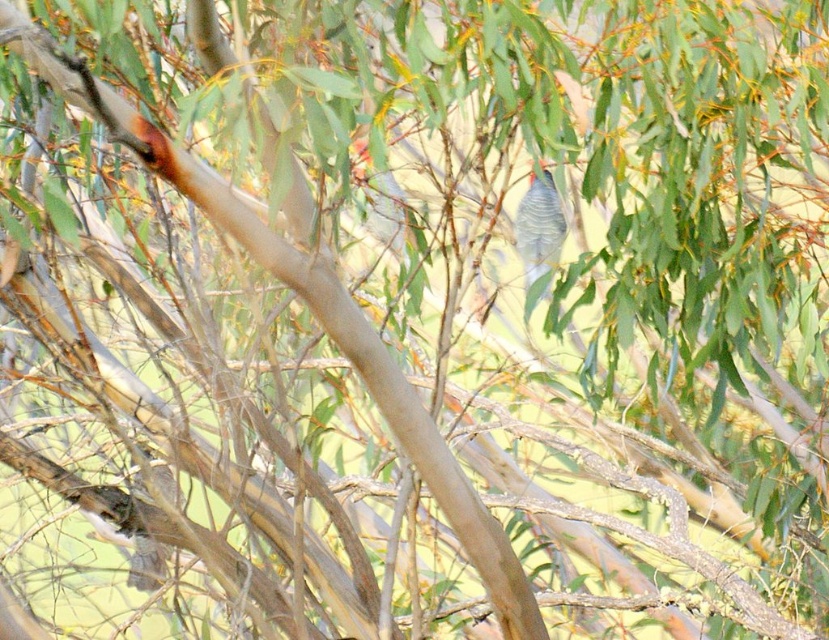
Question: Can you confirm if blue-gray feathers at center is bigger than speckled gray bird at center?

Choices:
 (A) yes
 (B) no

Answer: (B)

Question: Estimate the real-world distances between objects in this image. Which object is closer to the brown speckled feathers at lower left?

Choices:
 (A) speckled gray bird at center
 (B) blue-gray feathers at center

Answer: (A)

Question: Which object is closer to the camera taking this photo?

Choices:
 (A) brown speckled feathers at lower left
 (B) speckled gray bird at center
 (C) blue-gray feathers at center

Answer: (A)

Question: Is the position of blue-gray feathers at center more distant than that of brown speckled feathers at lower left?

Choices:
 (A) no
 (B) yes

Answer: (B)

Question: Can you confirm if blue-gray feathers at center is smaller than speckled gray bird at center?

Choices:
 (A) no
 (B) yes

Answer: (B)

Question: Which of the following is the farthest from the observer?

Choices:
 (A) (154, 552)
 (B) (551, 202)
 (C) (355, 177)

Answer: (B)